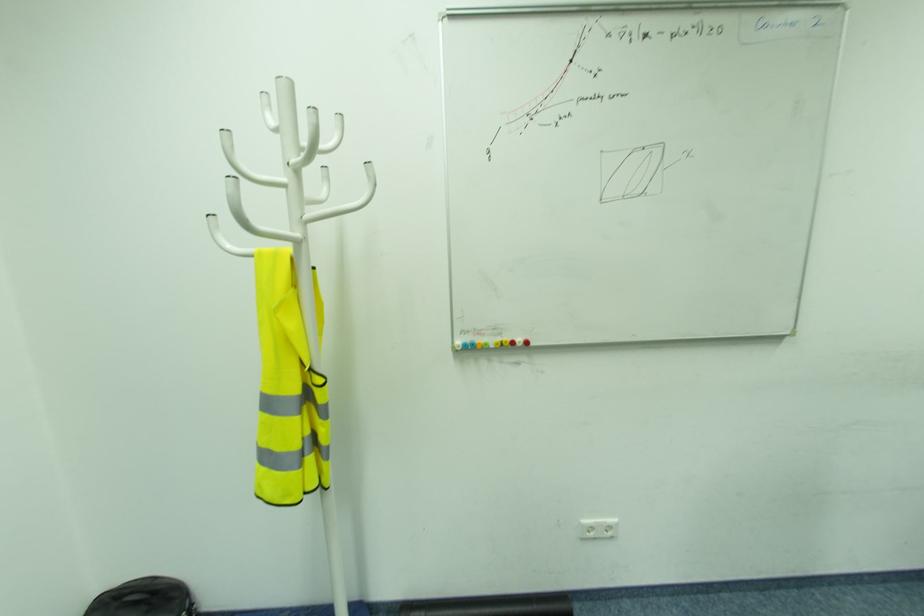
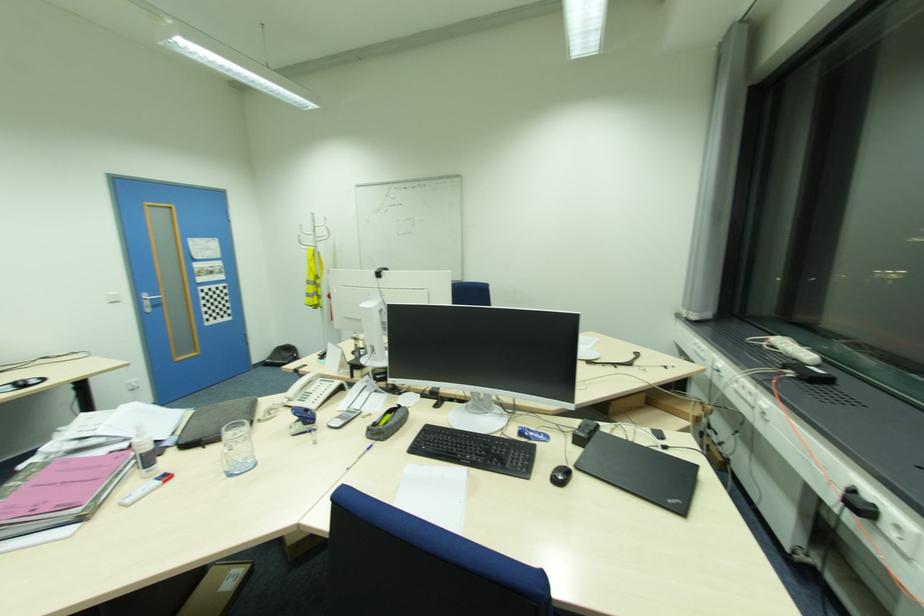
In a continuous first-person perspective shot, in which direction is the camera moving?

The cameraman moved toward right, backward.